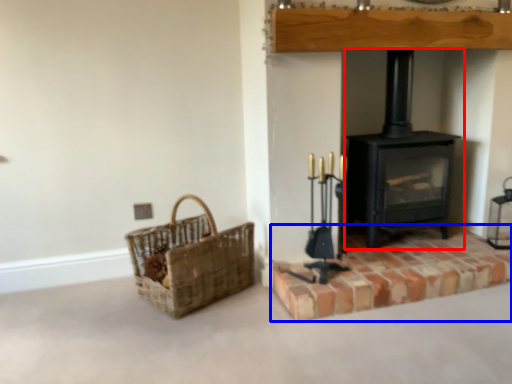
Question: Which point is closer to the camera, wood burning stove (highlighted by a red box) or brickwork (highlighted by a blue box)?

Choices:
 (A) wood burning stove
 (B) brickwork

Answer: (B)